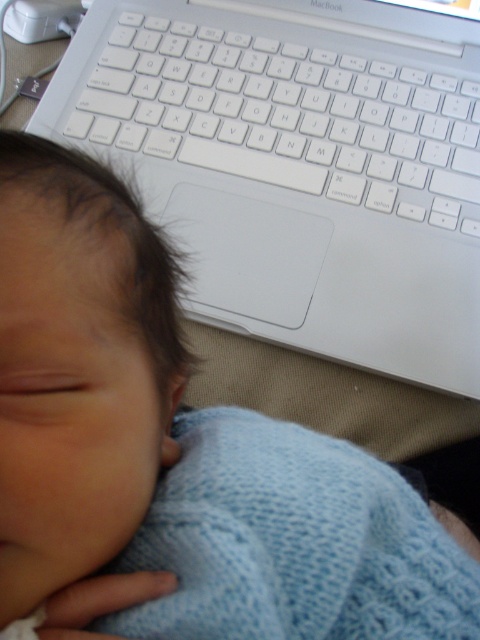
Question: Does white plastic keyboard at upper center have a lesser width compared to knitted blue blanket at lower left?

Choices:
 (A) no
 (B) yes

Answer: (A)

Question: Which object is farther from the camera taking this photo?

Choices:
 (A) knitted blue blanket at lower left
 (B) soft blue knit at lower left

Answer: (A)

Question: Among these points, which one is nearest to the camera?

Choices:
 (A) (312, 61)
 (B) (157, 632)

Answer: (B)

Question: Among these points, which one is farthest from the camera?

Choices:
 (A) (93, 104)
 (B) (122, 454)

Answer: (A)

Question: Is white plastic keyboard at upper center wider than knitted blue blanket at lower left?

Choices:
 (A) yes
 (B) no

Answer: (A)

Question: Is white plastic keyboard at upper center below knitted blue blanket at lower left?

Choices:
 (A) yes
 (B) no

Answer: (B)